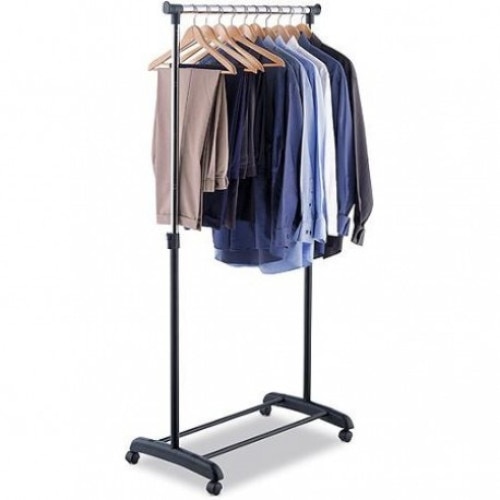
Where is `hangers`? The width and height of the screenshot is (500, 500). hangers is located at coordinates (196, 33), (209, 30), (218, 30), (233, 31), (243, 29), (255, 28), (267, 32), (277, 30), (291, 30), (303, 27).